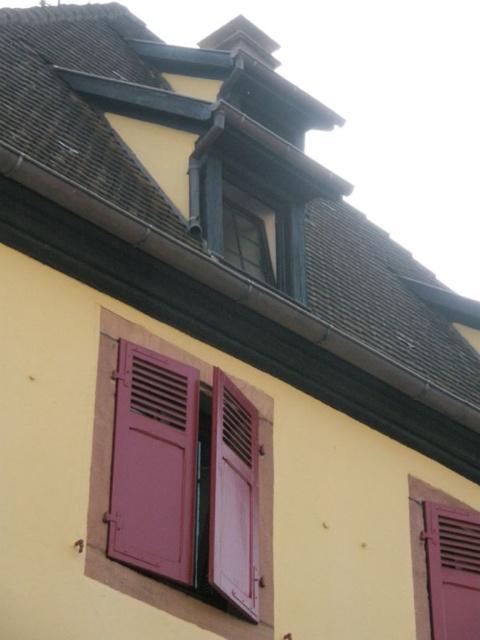
Between matte pink shutters at lower left and matte pink wood at center, which one is positioned higher?

matte pink shutters at lower left is above.

Is the position of matte pink shutters at lower left less distant than that of matte pink wood at center?

No, it is not.

Image resolution: width=480 pixels, height=640 pixels. What do you see at coordinates (184, 477) in the screenshot? I see `matte pink shutters at lower left` at bounding box center [184, 477].

Where is `matte pink shutters at lower left`? matte pink shutters at lower left is located at coordinates (184, 477).

Which of these two, matte pink wood at center or matte glass window at upper center, stands shorter?

With less height is matte glass window at upper center.

Is point (256, 444) positioned in front of point (232, 250)?

Yes, it is in front of point (232, 250).

Image resolution: width=480 pixels, height=640 pixels. In order to click on matte pink wood at center in this screenshot , I will do `click(233, 497)`.

Does matte pink shutters at lower left appear on the right side of matte glass window at upper center?

In fact, matte pink shutters at lower left is to the left of matte glass window at upper center.

Is point (192, 580) positioned behind point (266, 248)?

No, it is not.

Identify the location of matte pink shutters at lower left. (184, 477).